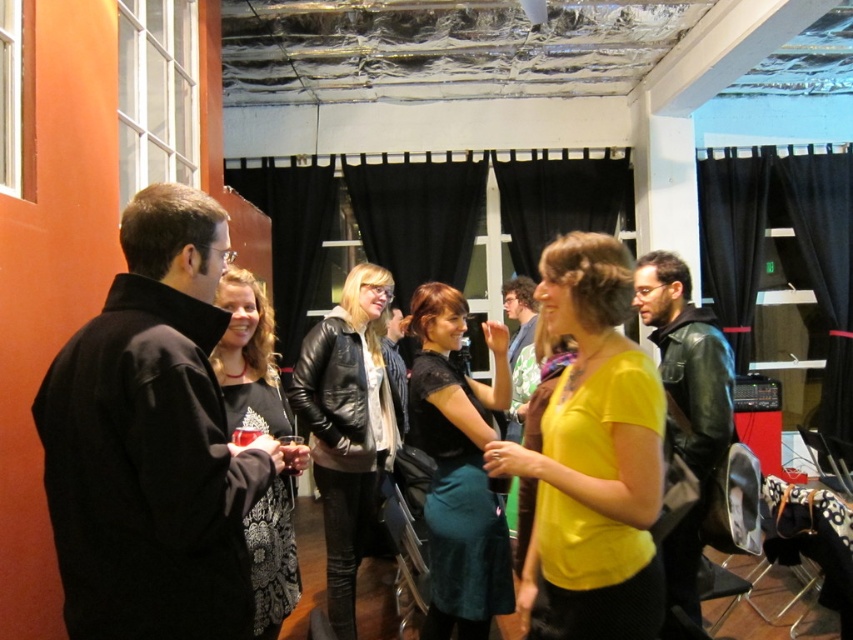
Question: Which object is farther from the camera taking this photo?

Choices:
 (A) black velvet dress at center
 (B) black lace dress at center
 (C) leather jacket at center

Answer: (C)

Question: Can you confirm if yellow matte shirt at center is wider than black velvet dress at center?

Choices:
 (A) yes
 (B) no

Answer: (A)

Question: Which object is positioned closest to the leather jacket at center?

Choices:
 (A) black velvet dress at center
 (B) yellow matte shirt at center

Answer: (A)

Question: Does yellow matte shirt at center appear on the left side of black lace dress at center?

Choices:
 (A) no
 (B) yes

Answer: (A)

Question: Which object is the farthest from the yellow matte shirt at center?

Choices:
 (A) leather jacket at center
 (B) black lace dress at center

Answer: (A)

Question: In this image, where is yellow matte shirt at center located relative to black lace dress at center?

Choices:
 (A) left
 (B) right

Answer: (B)